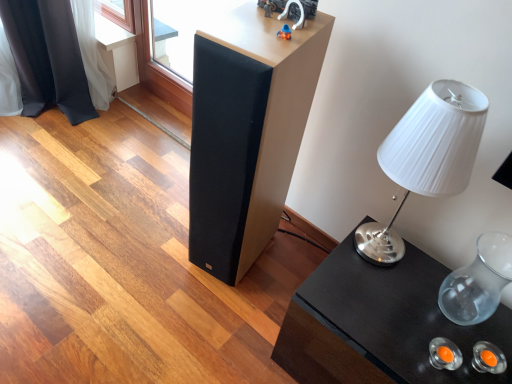
Where is `free space in front of white pleated fabric lampshade at right`? This screenshot has height=384, width=512. free space in front of white pleated fabric lampshade at right is located at coordinates (378, 298).